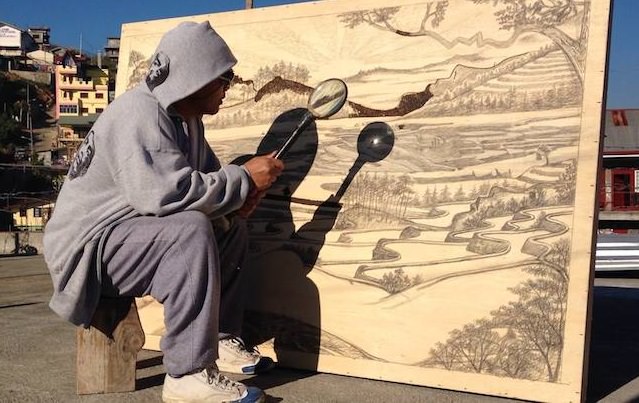
Locate an element on the screen. Image resolution: width=639 pixels, height=403 pixels. large light brown wood sheet panel with a landscape illustration is located at coordinates (124, 31).